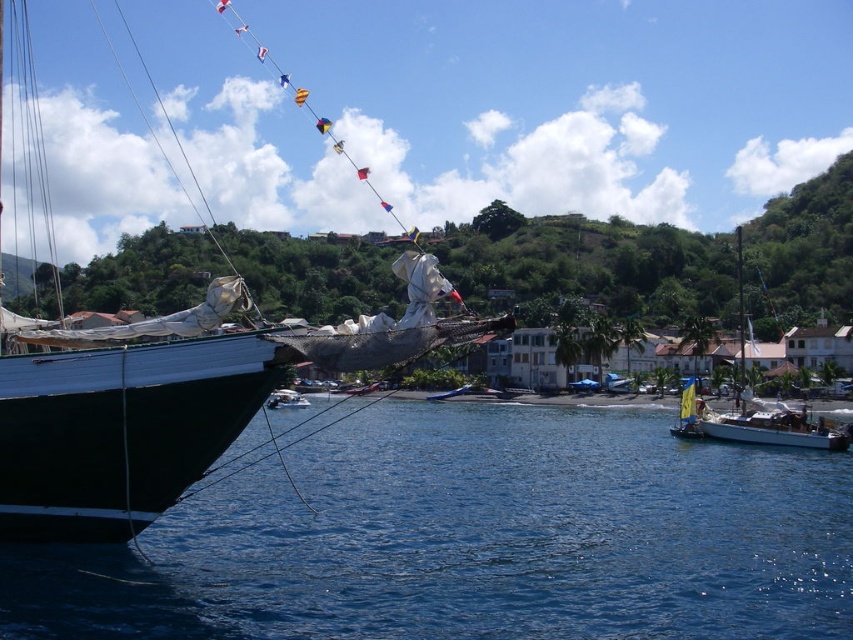
Is point (131, 481) positioned before point (283, 403)?

Yes, point (131, 481) is in front of point (283, 403).

Is shiny black sailboat at left bigger than white matte sailboat at center?

Yes, shiny black sailboat at left is bigger than white matte sailboat at center.

Does point (164, 410) lie in front of point (270, 404)?

Yes, point (164, 410) is closer to viewer.

You are a GUI agent. You are given a task and a screenshot of the screen. Output one action in this format:
    pyautogui.click(x=<x>, y=<y>)
    Task: Click on the shiny black sailboat at left
    
    Given the screenshot: What is the action you would take?
    pyautogui.click(x=165, y=401)

Is white glossy sailboat at lower right closer to camera compared to yellow fabric sailboat at right?

Yes, white glossy sailboat at lower right is closer to the viewer.

Is white glossy sailboat at lower right smaller than yellow fabric sailboat at right?

Indeed, white glossy sailboat at lower right has a smaller size compared to yellow fabric sailboat at right.

Who is more forward, (705,413) or (692,385)?

Positioned in front is point (705,413).

Find the location of a particular element. white glossy sailboat at lower right is located at coordinates (773, 428).

Is blue liquid water at lower left above white glossy sailboat at lower right?

Yes, blue liquid water at lower left is above white glossy sailboat at lower right.

Which is more to the right, blue liquid water at lower left or white glossy sailboat at lower right?

From the viewer's perspective, white glossy sailboat at lower right appears more on the right side.

What do you see at coordinates (473, 538) in the screenshot? I see `blue liquid water at lower left` at bounding box center [473, 538].

Locate an element on the screen. This screenshot has width=853, height=640. blue liquid water at lower left is located at coordinates (473, 538).